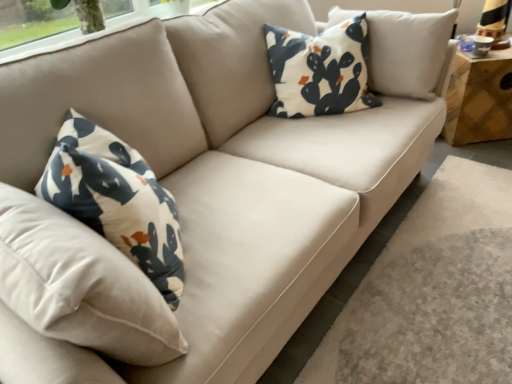
Question: Is white fabric pillow with cactus print at upper center situated inside wooden side table at right or outside?

Choices:
 (A) inside
 (B) outside

Answer: (B)

Question: Is point (292, 79) closer or farther from the camera than point (465, 142)?

Choices:
 (A) closer
 (B) farther

Answer: (A)

Question: From a real-world perspective, is white fabric pillow with cactus print at upper center physically located above or below wooden side table at right?

Choices:
 (A) below
 (B) above

Answer: (B)

Question: In terms of size, does wooden side table at right appear bigger or smaller than white fabric pillow with cactus print at upper center?

Choices:
 (A) small
 (B) big

Answer: (B)

Question: Is wooden side table at right to the left or to the right of white fabric pillow with cactus print at upper center in the image?

Choices:
 (A) left
 (B) right

Answer: (B)

Question: Does point (484, 129) appear closer or farther from the camera than point (338, 24)?

Choices:
 (A) farther
 (B) closer

Answer: (A)

Question: From a real-world perspective, relative to white fabric pillow with cactus print at upper center, is wooden side table at right vertically above or below?

Choices:
 (A) above
 (B) below

Answer: (B)